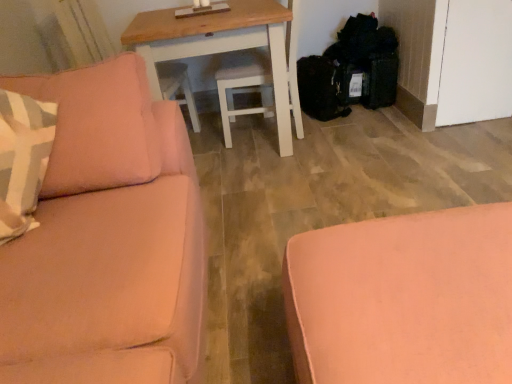
Question: Is wooden table at center taller than pink fabric ottoman at lower right, acting as the second studio couch starting from the left?

Choices:
 (A) no
 (B) yes

Answer: (B)

Question: Is pink fabric ottoman at lower right, acting as the second studio couch starting from the left, inside wooden table at center?

Choices:
 (A) yes
 (B) no

Answer: (B)

Question: Is wooden table at center shorter than pink fabric ottoman at lower right, the first studio couch from the right?

Choices:
 (A) no
 (B) yes

Answer: (A)

Question: From the image's perspective, does wooden table at center appear higher than pink fabric ottoman at lower right, the first studio couch from the right?

Choices:
 (A) no
 (B) yes

Answer: (B)

Question: Is wooden table at center completely or partially outside of pink fabric ottoman at lower right, the first studio couch from the right?

Choices:
 (A) no
 (B) yes

Answer: (B)

Question: Does wooden table at center appear on the right side of pink fabric ottoman at lower right, the first studio couch from the right?

Choices:
 (A) no
 (B) yes

Answer: (A)

Question: From the image's perspective, is satin pink couch at left, which appears as the second studio couch when viewed from the right, beneath pink fabric ottoman at lower right, the first studio couch from the right?

Choices:
 (A) no
 (B) yes

Answer: (A)

Question: Does satin pink couch at left, marked as the first studio couch in a left-to-right arrangement, have a smaller size compared to pink fabric ottoman at lower right, the first studio couch from the right?

Choices:
 (A) no
 (B) yes

Answer: (A)

Question: From the image's perspective, is satin pink couch at left, marked as the first studio couch in a left-to-right arrangement, above pink fabric ottoman at lower right, the first studio couch from the right?

Choices:
 (A) yes
 (B) no

Answer: (A)

Question: Considering the relative positions of satin pink couch at left, which appears as the second studio couch when viewed from the right, and pink fabric ottoman at lower right, acting as the second studio couch starting from the left, in the image provided, is satin pink couch at left, which appears as the second studio couch when viewed from the right, in front of pink fabric ottoman at lower right, acting as the second studio couch starting from the left,?

Choices:
 (A) no
 (B) yes

Answer: (B)

Question: Is satin pink couch at left, marked as the first studio couch in a left-to-right arrangement, far away from pink fabric ottoman at lower right, acting as the second studio couch starting from the left?

Choices:
 (A) no
 (B) yes

Answer: (A)

Question: Is satin pink couch at left, marked as the first studio couch in a left-to-right arrangement, outside of pink fabric ottoman at lower right, acting as the second studio couch starting from the left?

Choices:
 (A) no
 (B) yes

Answer: (B)

Question: Is satin pink couch at left, which appears as the second studio couch when viewed from the right, located within wooden table at center?

Choices:
 (A) no
 (B) yes

Answer: (A)